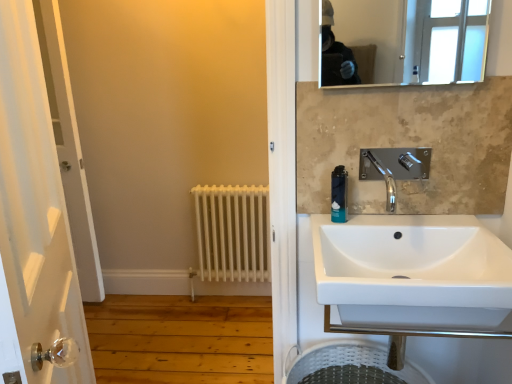
Find the location of a particular element. The width and height of the screenshot is (512, 384). vacant area in front of white matte radiator at lower left is located at coordinates (223, 331).